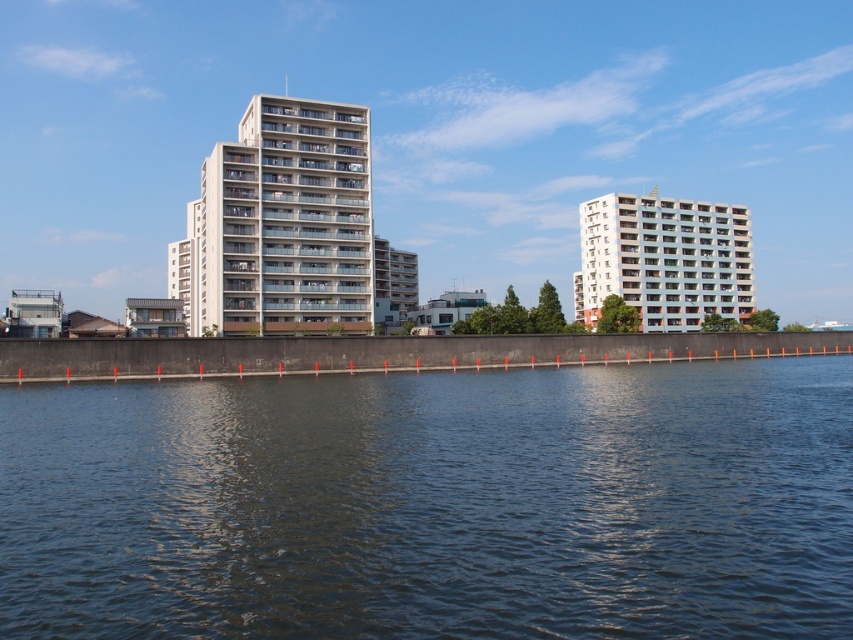
Does point (523, 438) lie in front of point (357, 145)?

Yes, it is in front of point (357, 145).

Consider the image. Who is higher up, dark blue water at center or white concrete building at center?

white concrete building at center is higher up.

The width and height of the screenshot is (853, 640). I want to click on dark blue water at center, so click(x=433, y=502).

Can you confirm if dark blue water at center is positioned above white smooth building at right?

No, dark blue water at center is not above white smooth building at right.

Between point (129, 467) and point (676, 288), which one is positioned in front?

Point (129, 467) is more forward.

This screenshot has width=853, height=640. Find the location of `dark blue water at center`. dark blue water at center is located at coordinates (433, 502).

Which is behind, point (259, 134) or point (654, 220)?

Point (654, 220)

Can you confirm if white concrete building at center is wider than white smooth building at right?

No, white concrete building at center is not wider than white smooth building at right.

Between point (285, 141) and point (703, 307), which one is positioned in front?

Point (285, 141) is more forward.

Image resolution: width=853 pixels, height=640 pixels. I want to click on white concrete building at center, so click(x=280, y=225).